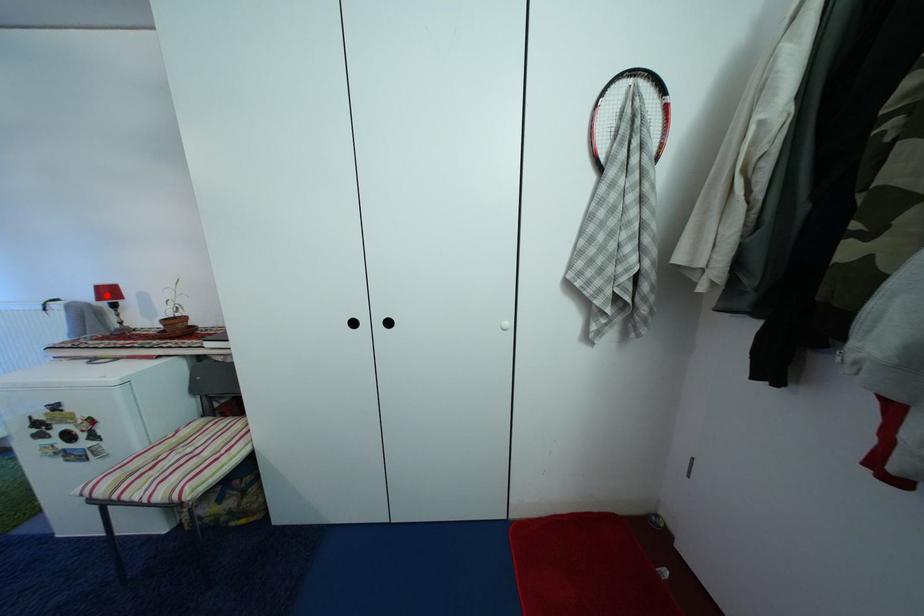
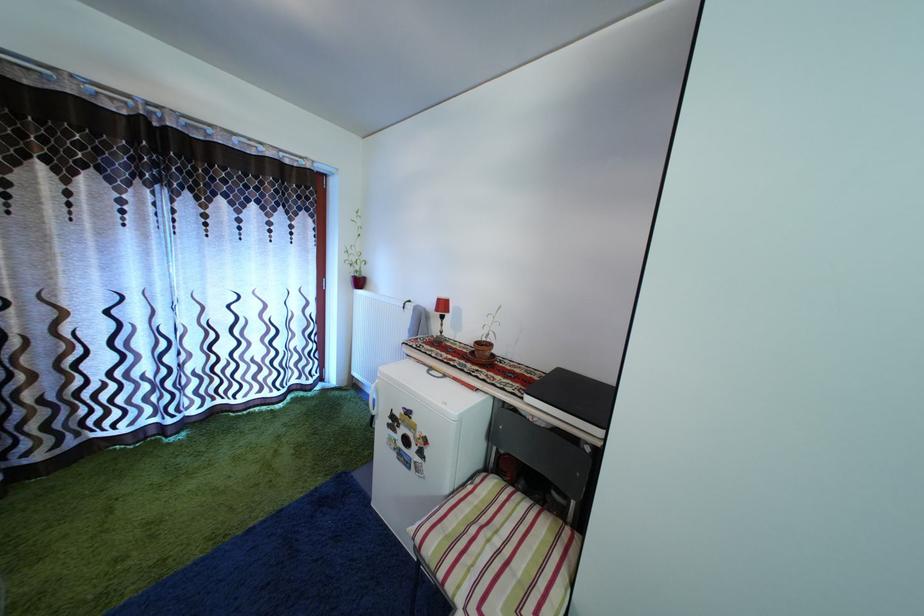
The point at the highlighted location is marked in the first image. Where is the corresponding point in the second image?

(446, 308)